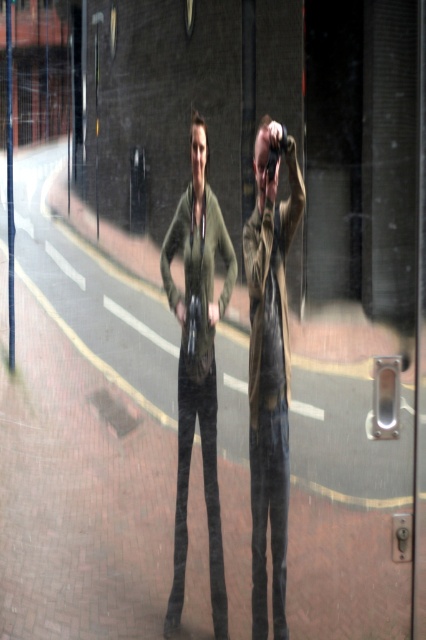
Which of these two, leather jacket at center or olive green fabric jacket at center, stands shorter?

olive green fabric jacket at center is shorter.

The image size is (426, 640). What do you see at coordinates (270, 371) in the screenshot? I see `leather jacket at center` at bounding box center [270, 371].

From the picture: Who is more distant from viewer, (264,289) or (201,324)?

The point (264,289) is more distant.

I want to click on leather jacket at center, so click(x=270, y=371).